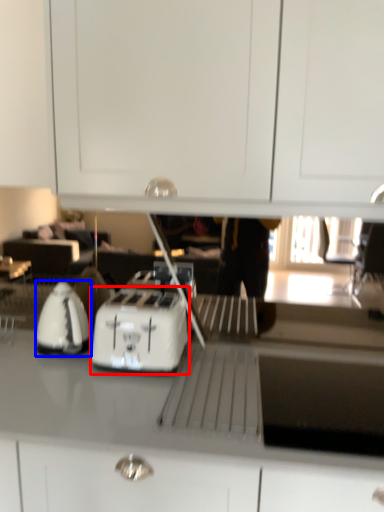
Question: Which object appears closest to the camera in this image, kitchen appliance (highlighted by a red box) or home appliance (highlighted by a blue box)?

Choices:
 (A) kitchen appliance
 (B) home appliance

Answer: (A)